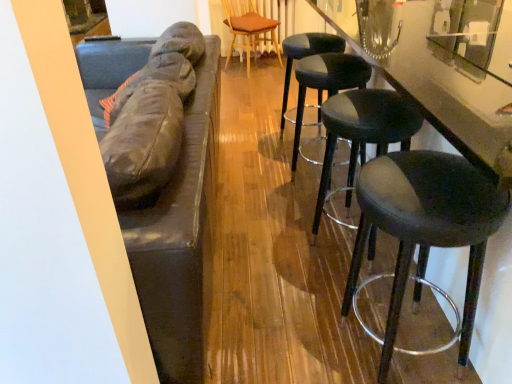
Question: From the image's perspective, would you say black leather stool at center, arranged as the 1th stool when viewed from the back, is shown under black leather stool at right, which is the third stool from front to back?

Choices:
 (A) yes
 (B) no

Answer: (B)

Question: Considering the relative sizes of black leather stool at center, arranged as the 1th stool when viewed from the back, and black leather stool at right, which is the third stool from front to back, in the image provided, is black leather stool at center, arranged as the 1th stool when viewed from the back, shorter than black leather stool at right, which is the third stool from front to back,?

Choices:
 (A) no
 (B) yes

Answer: (B)

Question: From the image's perspective, is black leather stool at center, arranged as the 1th stool when viewed from the back, on black leather stool at right, which is the third stool from front to back?

Choices:
 (A) no
 (B) yes

Answer: (B)

Question: Is black leather stool at center, arranged as the 1th stool when viewed from the back, oriented towards black leather stool at right, the 2th stool in the back-to-front sequence?

Choices:
 (A) yes
 (B) no

Answer: (B)

Question: Is black leather stool at center, the 4th stool when ordered from front to back, turned away from black leather stool at right, the 2th stool in the back-to-front sequence?

Choices:
 (A) no
 (B) yes

Answer: (A)

Question: Is wooden textured chair at center taller or shorter than glossy black counter at right?

Choices:
 (A) tall
 (B) short

Answer: (B)

Question: Based on their sizes in the image, would you say wooden textured chair at center is bigger or smaller than glossy black counter at right?

Choices:
 (A) small
 (B) big

Answer: (A)

Question: Is wooden textured chair at center in front of or behind glossy black counter at right in the image?

Choices:
 (A) front
 (B) behind

Answer: (B)

Question: In terms of width, does wooden textured chair at center look wider or thinner when compared to glossy black counter at right?

Choices:
 (A) thin
 (B) wide

Answer: (A)

Question: Looking at their shapes, would you say black leather stool at right, which is the third stool from front to back, is wider or thinner than glossy black counter at right?

Choices:
 (A) thin
 (B) wide

Answer: (A)

Question: In terms of height, does black leather stool at right, the 2th stool in the back-to-front sequence, look taller or shorter compared to glossy black counter at right?

Choices:
 (A) tall
 (B) short

Answer: (B)

Question: From the image's perspective, is black leather stool at right, which is the third stool from front to back, located above or below glossy black counter at right?

Choices:
 (A) above
 (B) below

Answer: (A)

Question: Visually, is black leather stool at right, the 2th stool in the back-to-front sequence, positioned to the left or to the right of glossy black counter at right?

Choices:
 (A) left
 (B) right

Answer: (A)

Question: In the image, is matte black stool at right, the second stool in the front-to-back sequence, positioned in front of or behind glossy black counter at right?

Choices:
 (A) front
 (B) behind

Answer: (B)

Question: Is matte black stool at right, the second stool in the front-to-back sequence, inside or outside of glossy black counter at right?

Choices:
 (A) outside
 (B) inside

Answer: (B)